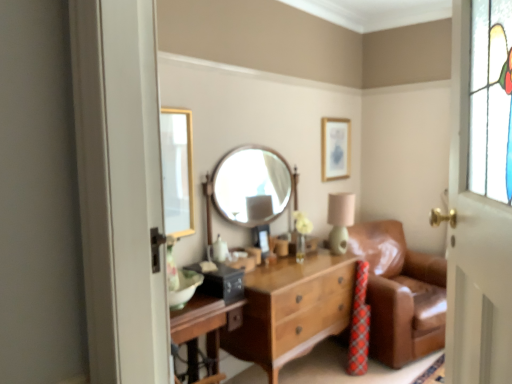
Locate an element on the screen. free location in front of matte green table lamp at center is located at coordinates (332, 260).